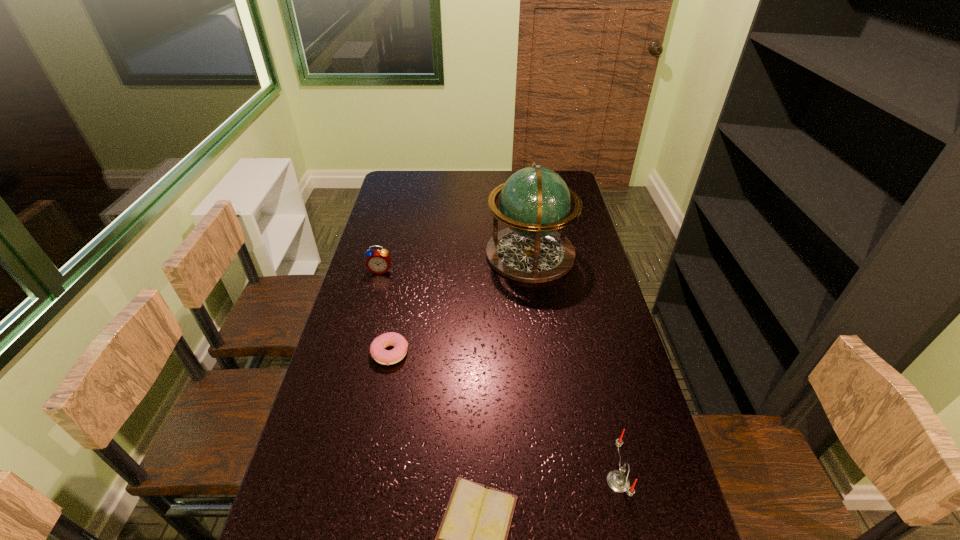
What are the coordinates of `globe` in the screenshot? It's located at (534, 202).

Locate an element on the screen. candle is located at coordinates [618, 481].

Identify the location of alarm clock. This screenshot has height=540, width=960. (378, 261).

This screenshot has height=540, width=960. Find the location of `the third nearest object`. the third nearest object is located at coordinates (377, 348).

Locate an element on the screen. The image size is (960, 540). doughnut is located at coordinates pyautogui.click(x=377, y=348).

You are a GUI agent. You are given a task and a screenshot of the screen. Output one action in this format:
    pyautogui.click(x=<x>, y=<y>)
    Task: Click on the vacant space located on the front-facing side of the tallest object
    
    Given the screenshot: What is the action you would take?
    pyautogui.click(x=389, y=254)

I want to click on vacant area situated 0.360m on the front-facing side of the tallest object, so click(389, 254).

This screenshot has width=960, height=540. What are the coordinates of `vacant space located 0.210m on the front-facing side of the tallest object` in the screenshot? It's located at (429, 254).

Find the location of a particular element. free space located 0.120m on the front-facing side of the candle is located at coordinates (554, 482).

Identify the location of free space located 0.190m on the front-facing side of the candle. The width and height of the screenshot is (960, 540). (523, 482).